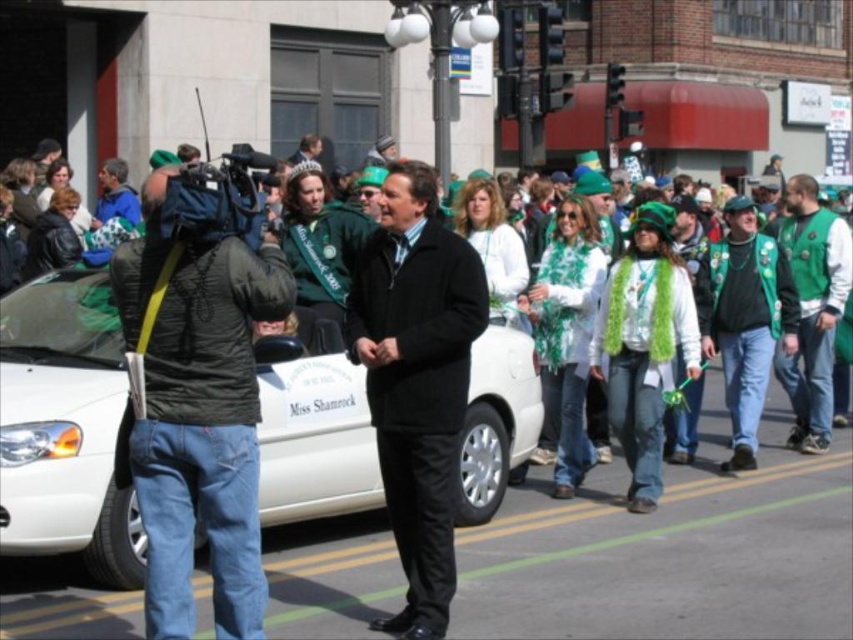
Is black matte suit at center bigger than green textured vest at right?

Incorrect, black matte suit at center is not larger than green textured vest at right.

Is black matte suit at center taller than green textured vest at right?

No.

At what (x,y) coordinates should I click in order to perform the action: click on black matte suit at center. Please return your answer as a coordinate pair (x, y). The width and height of the screenshot is (853, 640). Looking at the image, I should click on (416, 380).

This screenshot has height=640, width=853. I want to click on black matte suit at center, so click(x=416, y=380).

Who is more distant from viewer, (511, 435) or (816, 348)?

Point (816, 348)

Between point (73, 269) and point (796, 369), which one is positioned behind?

Point (796, 369)

The image size is (853, 640). I want to click on white glossy car at center, so click(x=65, y=426).

Which is below, white glossy car at center or dark green jacket at left?

white glossy car at center

Is white glossy car at center bigger than dark green jacket at left?

Correct, white glossy car at center is larger in size than dark green jacket at left.

You are a GUI agent. You are given a task and a screenshot of the screen. Output one action in this format:
    pyautogui.click(x=<x>, y=<y>)
    Task: Click on the white glossy car at center
    The image size is (853, 640).
    Given the screenshot: What is the action you would take?
    pyautogui.click(x=65, y=426)